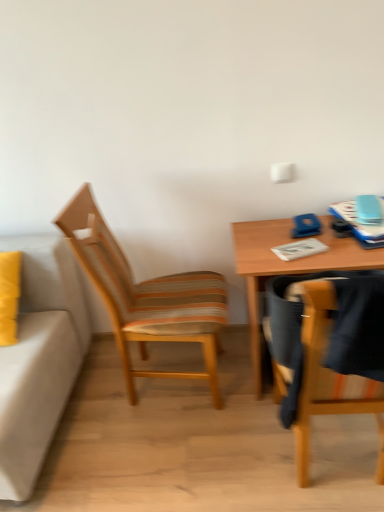
Identify the location of unoccupied area in front of woodenchair at left, the first chair when ordered from back to front. (174, 457).